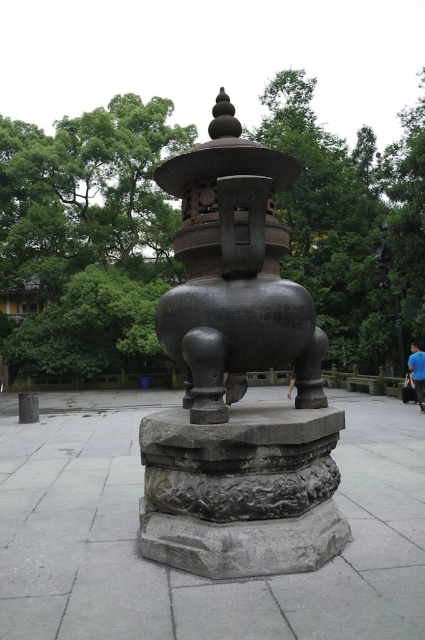
Is bronze textured censer at center shorter than blue fabric person at lower right?

Yes.

Is bronze textured censer at center thinner than blue fabric person at lower right?

No, bronze textured censer at center is not thinner than blue fabric person at lower right.

Describe the element at coordinates (238, 380) in the screenshot. The height and width of the screenshot is (640, 425). I see `bronze textured censer at center` at that location.

I want to click on bronze textured censer at center, so click(x=238, y=380).